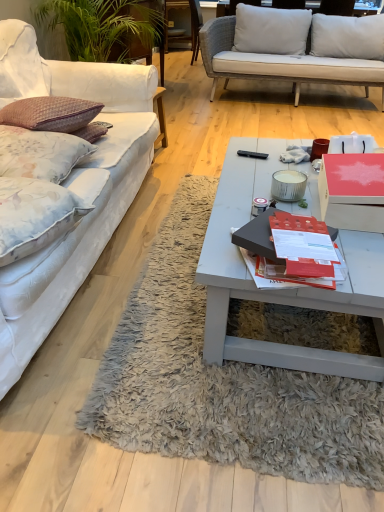
You are a GUI agent. You are given a task and a screenshot of the screen. Output one action in this format:
    pyautogui.click(x=<x>, y=<y>)
    Task: Click on the vacant area on top of matte gray coffee table at center (from a real-world perspective)
    The height and width of the screenshot is (512, 384).
    Given the screenshot: What is the action you would take?
    pyautogui.click(x=270, y=177)